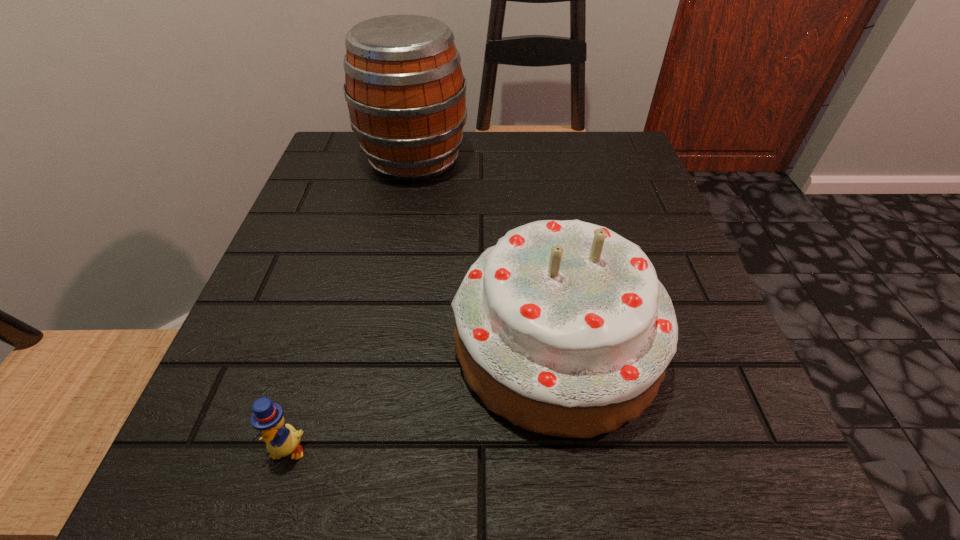
Locate an element on the screen. The height and width of the screenshot is (540, 960). unoccupied position between the cake and the duckling is located at coordinates (421, 396).

I want to click on vacant space in between the tallest object and the duckling, so click(350, 304).

You are a GUI agent. You are given a task and a screenshot of the screen. Output one action in this format:
    pyautogui.click(x=<x>, y=<y>)
    Task: Click on the free space between the cake and the shortest object
    
    Given the screenshot: What is the action you would take?
    pyautogui.click(x=421, y=396)

Identify the location of free space between the duckling and the cider. (350, 304).

Where is `vacant space in between the second tallest object and the duckling`? Image resolution: width=960 pixels, height=540 pixels. vacant space in between the second tallest object and the duckling is located at coordinates (421, 396).

Find the location of a particular element. The image size is (960, 540). free space between the second shortest object and the duckling is located at coordinates click(421, 396).

Where is `free space between the duckling and the tallest object`? This screenshot has width=960, height=540. free space between the duckling and the tallest object is located at coordinates (350, 304).

Identify which object is the nearest to the shortest object. Please provide its 2D coordinates. Your answer should be formatted as a tuple, i.e. [(x, y)], where the tuple contains the x and y coordinates of a point satisfying the conditions above.

[(563, 328)]

Image resolution: width=960 pixels, height=540 pixels. Find the location of `object that stands as the second closest to the cake`. object that stands as the second closest to the cake is located at coordinates (406, 94).

Where is `vacant region that satisfies the following two spatial constraints: 1. on the front side of the cake; 2. on the right side of the tallest object`? vacant region that satisfies the following two spatial constraints: 1. on the front side of the cake; 2. on the right side of the tallest object is located at coordinates (378, 344).